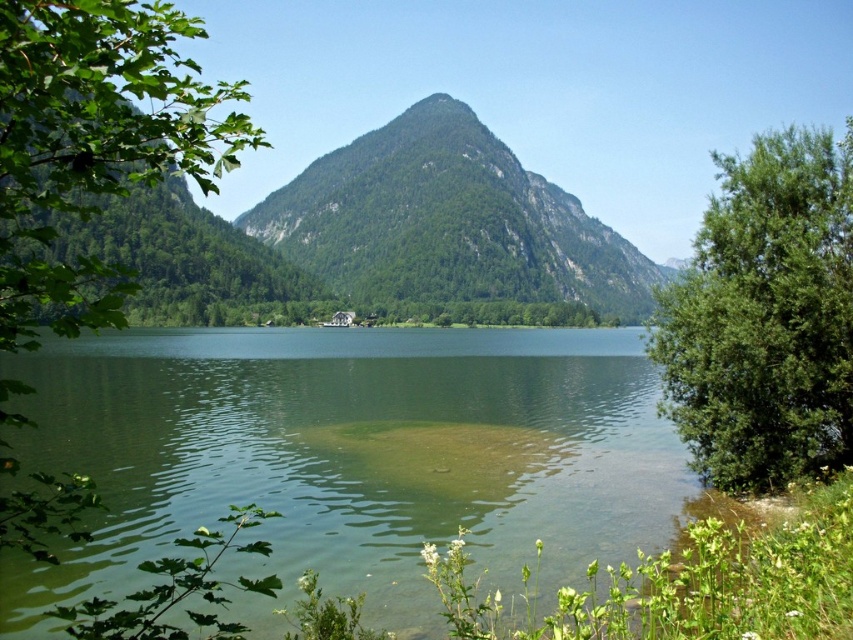
Question: Which object is positioned farthest from the green leafy bush at right?

Choices:
 (A) green translucent water at center
 (B) green forested mountain at center

Answer: (B)

Question: Which object appears closest to the camera in this image?

Choices:
 (A) green translucent water at center
 (B) green forested mountain at center
 (C) green leafy bush at right

Answer: (A)

Question: Is the position of green translucent water at center more distant than that of green leafy bush at right?

Choices:
 (A) no
 (B) yes

Answer: (A)

Question: Which of the following is the farthest from the observer?

Choices:
 (A) coord(245,227)
 (B) coord(761,403)
 (C) coord(489,547)

Answer: (A)

Question: Is green translucent water at center bigger than green leafy bush at right?

Choices:
 (A) no
 (B) yes

Answer: (B)

Question: Is green leafy tree at left above green leafy bush at right?

Choices:
 (A) yes
 (B) no

Answer: (A)